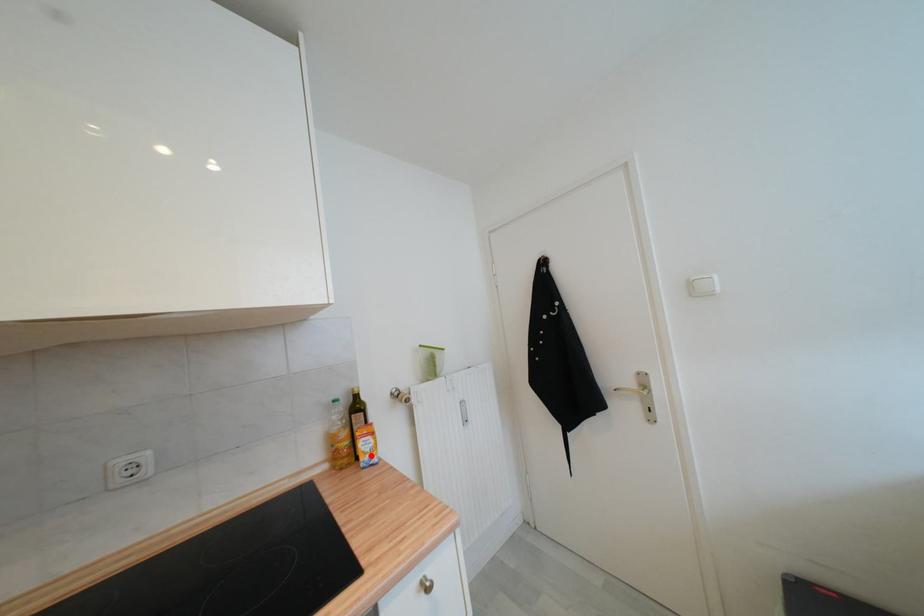
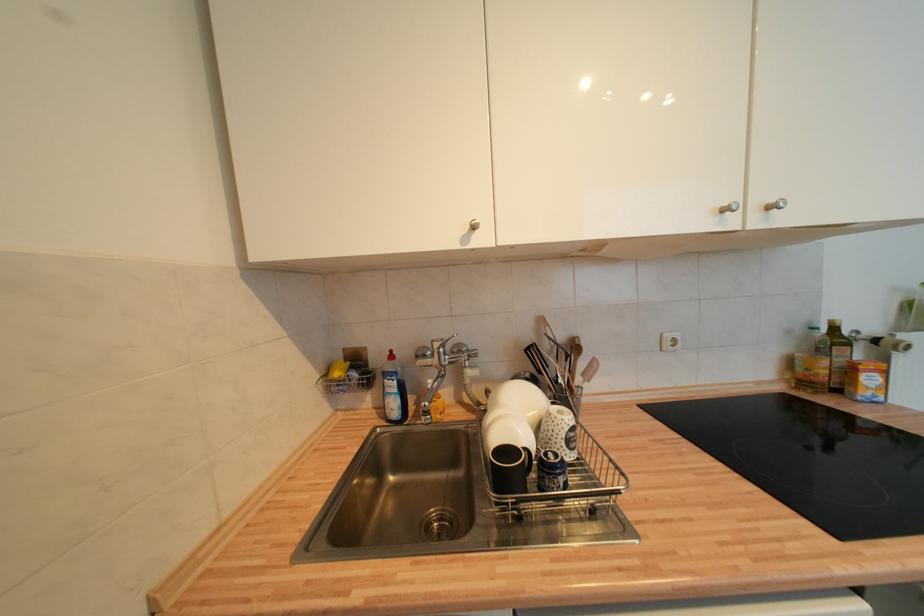
Where in the second image is the point corresponding to the highlighted location from the first image?

(873, 391)